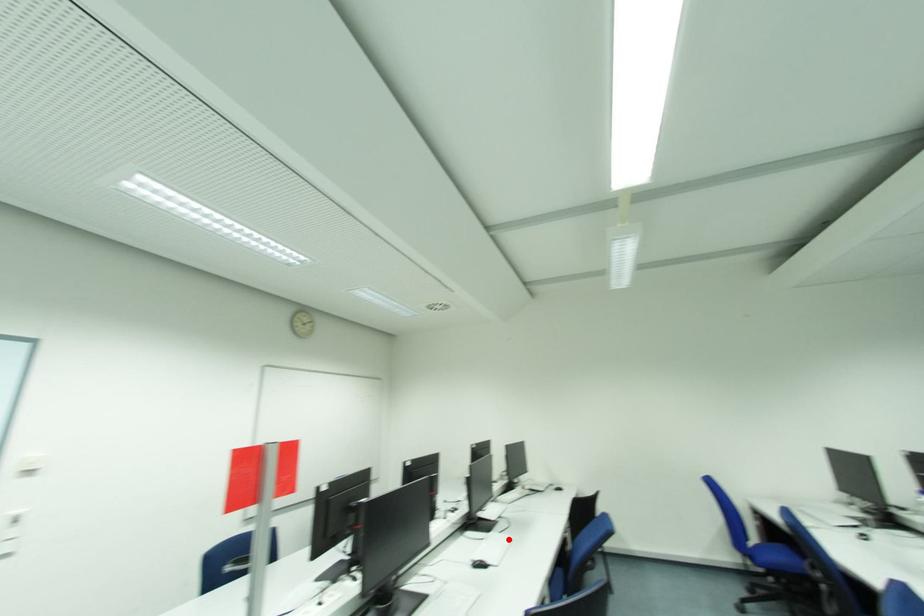
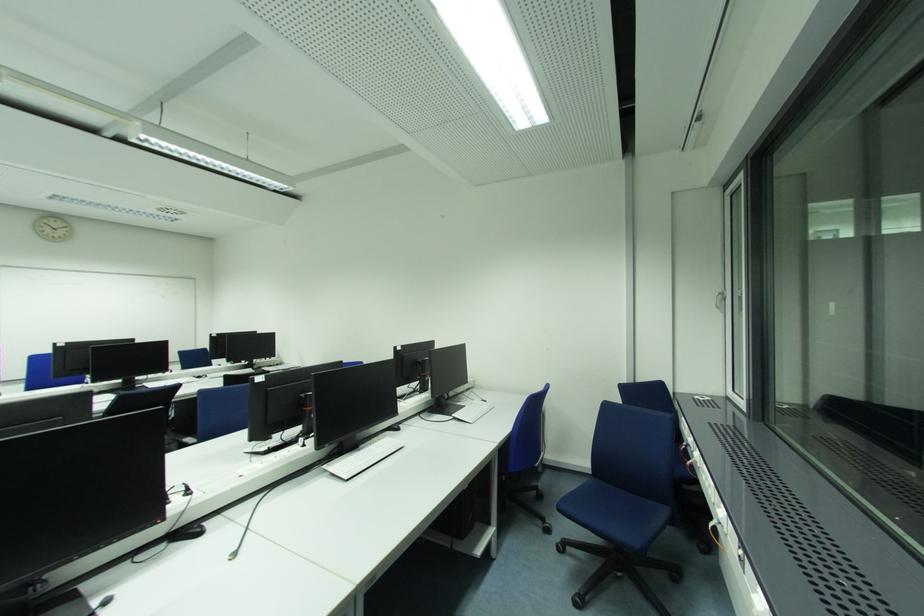
Question: I am providing you with two images of the same scene from different viewpoints. A red point is marked on the first image. At the location where the point appears in image 1, is it still visible in image 2?

Choices:
 (A) Yes
 (B) No

Answer: (B)